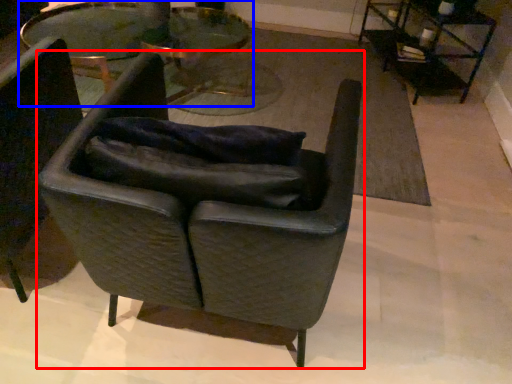
Question: Which object is closer to the camera taking this photo, chair (highlighted by a red box) or table (highlighted by a blue box)?

Choices:
 (A) chair
 (B) table

Answer: (A)